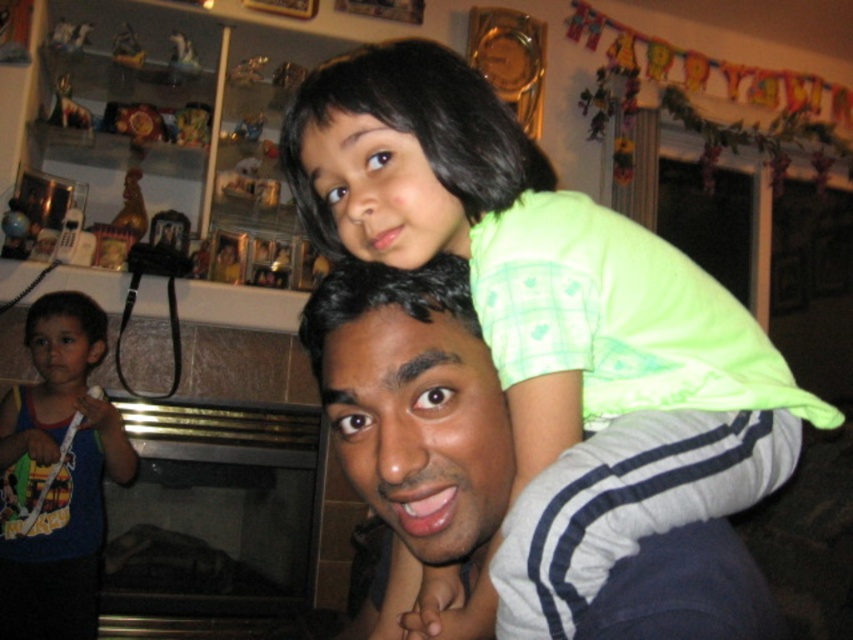
Question: Does gray/white striped shirt at upper center have a larger size compared to blue cotton tank top at left?

Choices:
 (A) no
 (B) yes

Answer: (A)

Question: Can you confirm if gray/white striped shirt at upper center is wider than blue cotton tank top at left?

Choices:
 (A) yes
 (B) no

Answer: (B)

Question: Which of the following is the farthest from the observer?

Choices:
 (A) blue cotton tank top at left
 (B) gray/white striped shirt at upper center

Answer: (A)

Question: Is gray/white striped shirt at upper center further to the viewer compared to blue cotton tank top at left?

Choices:
 (A) yes
 (B) no

Answer: (B)

Question: Which of the following is the farthest from the observer?

Choices:
 (A) (421, 388)
 (B) (22, 332)

Answer: (B)